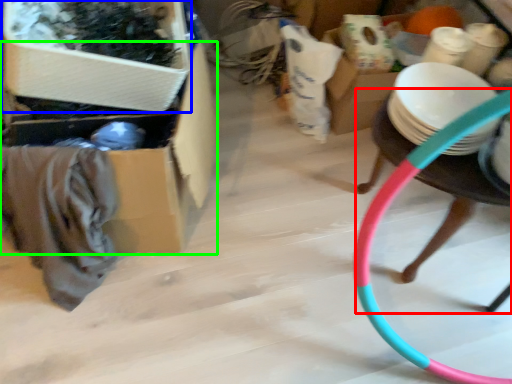
Question: Which is farther away from chair (highlighted by a red box)? storage box (highlighted by a blue box) or storage box (highlighted by a green box)?

Choices:
 (A) storage box
 (B) storage box

Answer: (A)